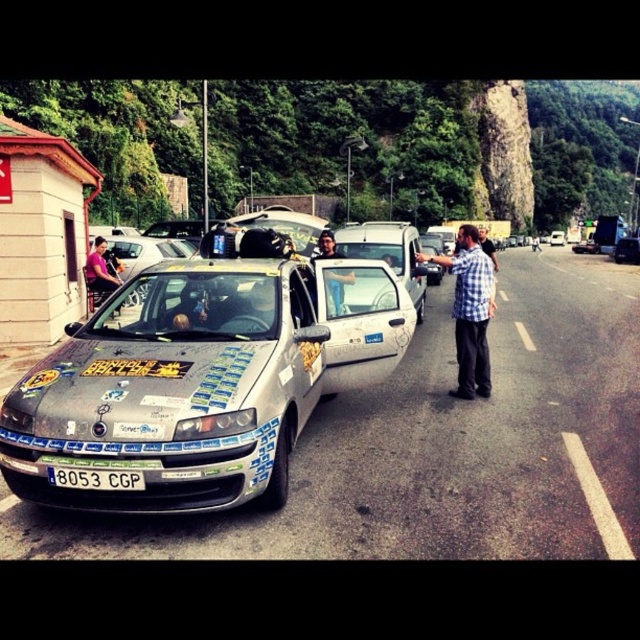
Question: Among these objects, which one is farthest from the camera?

Choices:
 (A) scratched metallic taxi at left
 (B) silver metallic hatchback at center

Answer: (B)

Question: Which object appears closest to the camera in this image?

Choices:
 (A) shiny silver car at center
 (B) plaid shirt at center

Answer: (B)

Question: Does scratched metallic taxi at left appear on the right side of white matte van at center?

Choices:
 (A) yes
 (B) no

Answer: (B)

Question: Can you confirm if plaid shirt at center is thinner than blue jeans at center?

Choices:
 (A) yes
 (B) no

Answer: (B)

Question: Which is nearer to the white matte van at center?

Choices:
 (A) blue jeans at center
 (B) scratched metallic taxi at left

Answer: (B)

Question: Is scratched metallic taxi at left wider than blue jeans at center?

Choices:
 (A) no
 (B) yes

Answer: (B)